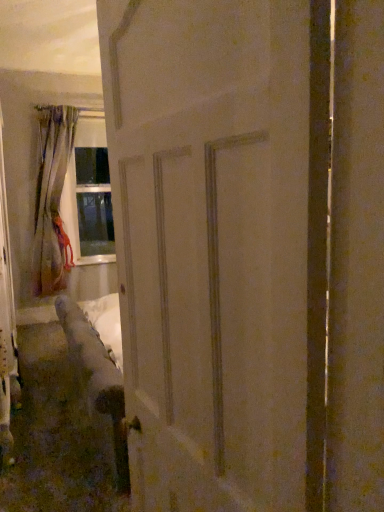
This screenshot has height=512, width=384. I want to click on white matte door at center, so click(x=211, y=246).

What do you see at coordinates (211, 246) in the screenshot? I see `white matte door at center` at bounding box center [211, 246].

At what (x,y) coordinates should I click in order to perform the action: click on beige fabric curtain at left. Please return your answer as a coordinate pair (x, y). The height and width of the screenshot is (512, 384). Looking at the image, I should click on (52, 202).

What do you see at coordinates (52, 202) in the screenshot? I see `beige fabric curtain at left` at bounding box center [52, 202].

The height and width of the screenshot is (512, 384). What are the coordinates of `white matte door at center` in the screenshot? It's located at (211, 246).

Considering the positions of objects beige fabric curtain at left and white matte door at center in the image provided, who is more to the right, beige fabric curtain at left or white matte door at center?

white matte door at center.

Is the position of beige fabric curtain at left more distant than that of white matte door at center?

Yes, the depth of beige fabric curtain at left is greater than that of white matte door at center.

Is point (56, 281) more distant than point (181, 98)?

Yes.

From the image's perspective, would you say beige fabric curtain at left is positioned over white matte door at center?

Indeed, from the image's perspective, beige fabric curtain at left is shown above white matte door at center.

From a real-world perspective, who is located lower, beige fabric curtain at left or white matte door at center?

From a 3D spatial view, white matte door at center is below.

In terms of width, does beige fabric curtain at left look wider or thinner when compared to white matte door at center?

Considering their sizes, beige fabric curtain at left looks broader than white matte door at center.

Does beige fabric curtain at left have a greater height compared to white matte door at center?

Yes, beige fabric curtain at left is taller than white matte door at center.

Does beige fabric curtain at left have a larger size compared to white matte door at center?

Correct, beige fabric curtain at left is larger in size than white matte door at center.

Is white matte door at center inside beige fabric curtain at left?

No, white matte door at center is not inside beige fabric curtain at left.

Is beige fabric curtain at left not near white matte door at center?

beige fabric curtain at left is positioned a significant distance from white matte door at center.

Is beige fabric curtain at left positioned with its back to white matte door at center?

No, beige fabric curtain at left is not facing away from white matte door at center.

Measure the distance between beige fabric curtain at left and white matte door at center.

A distance of 3.70 meters exists between beige fabric curtain at left and white matte door at center.

This screenshot has width=384, height=512. What are the coordinates of `door below the beige fabric curtain at left (from the image's perspective)` in the screenshot? It's located at (211, 246).

Between white matte door at center and beige fabric curtain at left, which one appears on the left side from the viewer's perspective?

beige fabric curtain at left is more to the left.

Is white matte door at center in front of or behind beige fabric curtain at left in the image?

white matte door at center is positioned closer to the viewer than beige fabric curtain at left.

Is point (254, 471) farther from camera compared to point (49, 198)?

That is False.

From the image's perspective, between white matte door at center and beige fabric curtain at left, who is located below?

white matte door at center is shown below in the image.

From a real-world perspective, between white matte door at center and beige fabric curtain at left, who is vertically higher?

In real-world perspective, beige fabric curtain at left is above.

Considering the sizes of white matte door at center and beige fabric curtain at left in the image, is white matte door at center wider or thinner than beige fabric curtain at left?

Clearly, white matte door at center has less width compared to beige fabric curtain at left.

Who is shorter, white matte door at center or beige fabric curtain at left?

white matte door at center.

Based on the photo, does white matte door at center have a smaller size compared to beige fabric curtain at left?

Correct, white matte door at center occupies less space than beige fabric curtain at left.

Is beige fabric curtain at left completely or partially inside white matte door at center?

No.

Is white matte door at center next to beige fabric curtain at left?

There is a gap between white matte door at center and beige fabric curtain at left.

Is white matte door at center aimed at beige fabric curtain at left?

No, white matte door at center is not aimed at beige fabric curtain at left.

What's the angular difference between white matte door at center and beige fabric curtain at left's facing directions?

There is a 83.4-degree angle between the facing directions of white matte door at center and beige fabric curtain at left.

The height and width of the screenshot is (512, 384). In order to click on curtain above the white matte door at center (from the image's perspective) in this screenshot , I will do `click(52, 202)`.

Where is `curtain that is above the white matte door at center (from the image's perspective)`? The width and height of the screenshot is (384, 512). curtain that is above the white matte door at center (from the image's perspective) is located at coordinates (52, 202).

This screenshot has height=512, width=384. In order to click on curtain above the white matte door at center (from a real-world perspective) in this screenshot , I will do `click(52, 202)`.